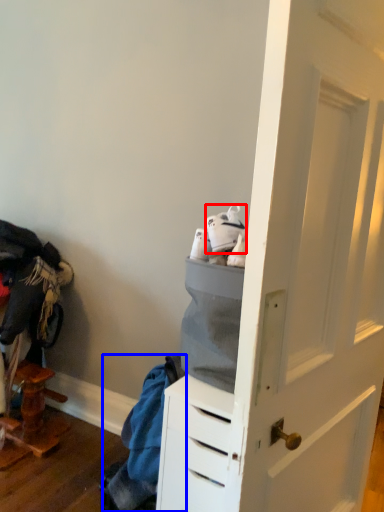
Question: Which object appears farthest to the camera in this image, footwear (highlighted by a red box) or clothing (highlighted by a blue box)?

Choices:
 (A) footwear
 (B) clothing

Answer: (B)